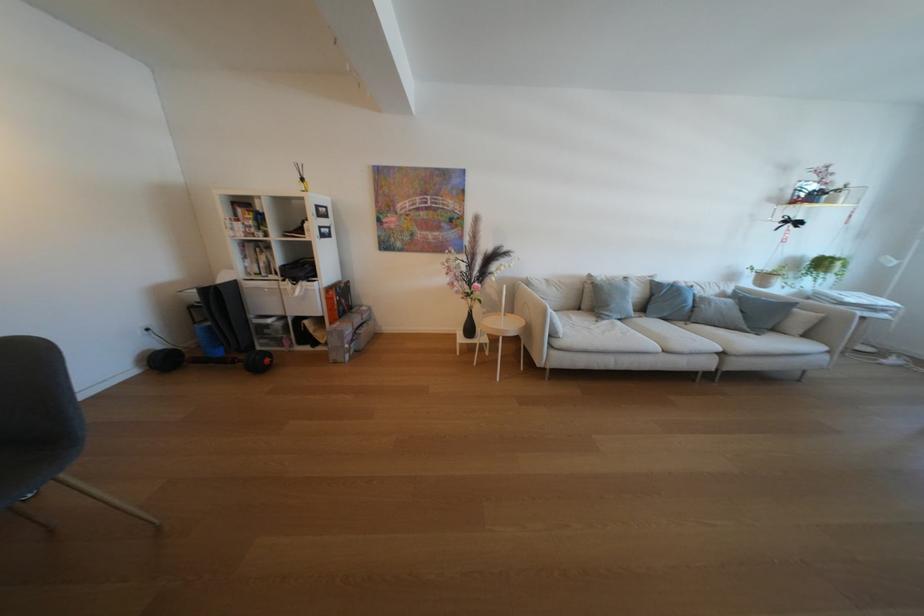
Locate an element on the screen. The image size is (924, 616). white sofa sitting surface is located at coordinates (624, 338).